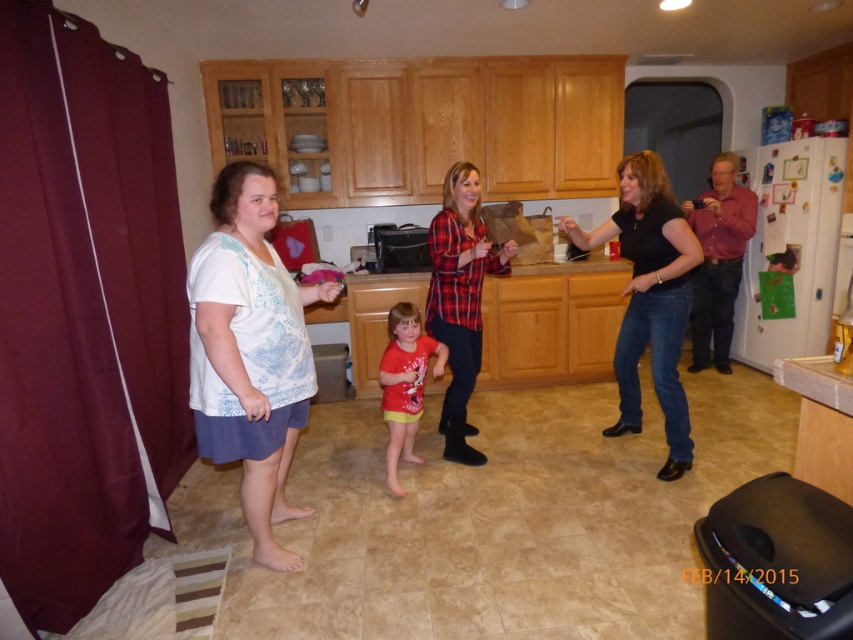
Between white cotton shirt at left and white printed blouse at center, which one appears on the left side from the viewer's perspective?

white printed blouse at center is more to the left.

Measure the distance between white cotton shirt at left and white printed blouse at center.

They are 32.83 inches apart.

Which is behind, point (502, 280) or point (225, 216)?

The point (502, 280) is more distant.

What are the coordinates of `white cotton shirt at left` in the screenshot? It's located at (633, 301).

Is point (287, 508) less distant than point (416, 376)?

Yes, point (287, 508) is closer to viewer.

Can you confirm if white cotton shirt at left is taller than matte red shirt at center?

Yes.

This screenshot has height=640, width=853. Describe the element at coordinates (633, 301) in the screenshot. I see `white cotton shirt at left` at that location.

Where is `white cotton shirt at left`? white cotton shirt at left is located at coordinates (633, 301).

Is black matte shirt at center taller than matte red shirt at center?

Correct, black matte shirt at center is much taller as matte red shirt at center.

Describe the element at coordinates (648, 298) in the screenshot. I see `black matte shirt at center` at that location.

At what (x,y) coordinates should I click in order to perform the action: click on black matte shirt at center. Please return your answer as a coordinate pair (x, y). The height and width of the screenshot is (640, 853). Looking at the image, I should click on (648, 298).